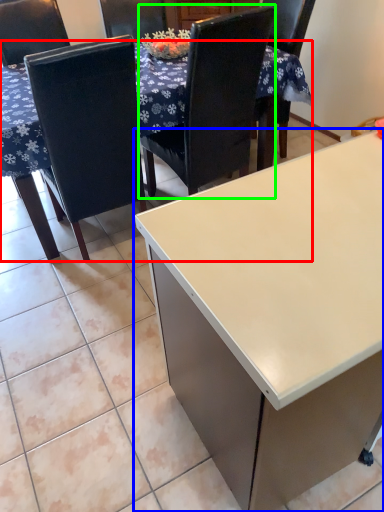
Question: Based on their relative distances, which object is farther from table (highlighted by a red box)? Choose from desk (highlighted by a blue box) and chair (highlighted by a green box).

Choices:
 (A) desk
 (B) chair

Answer: (A)